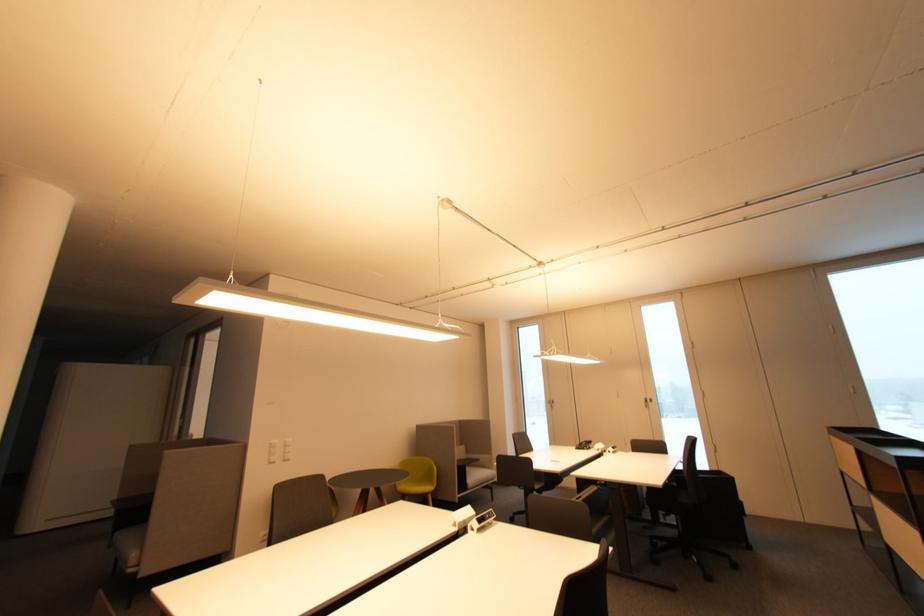
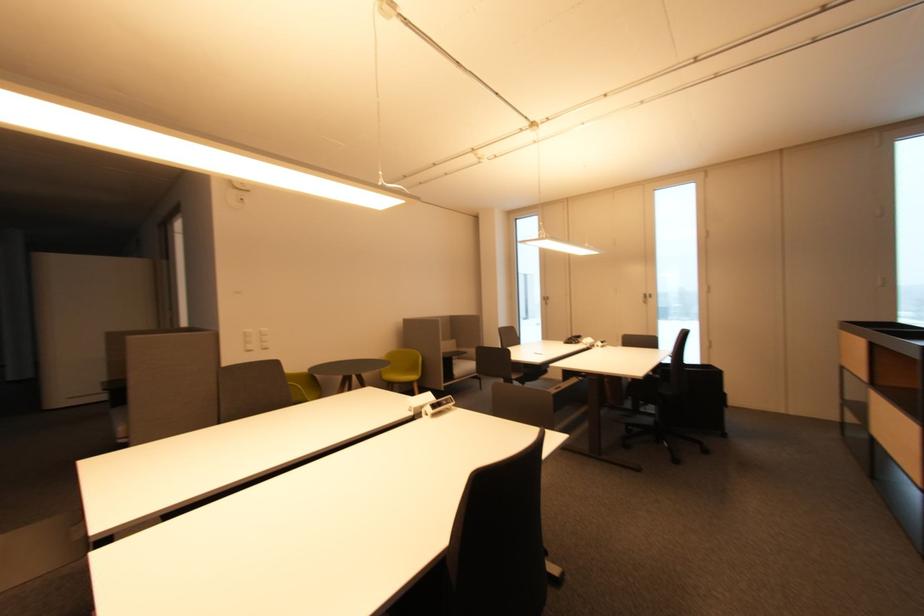
The images are taken continuously from a first-person perspective. In which direction are you moving?

The cameraman moved toward right, forward.